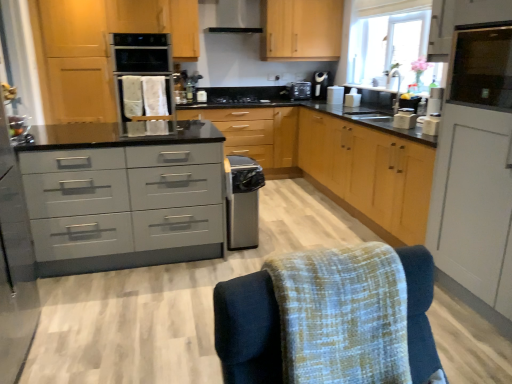
Question: Is the depth of textured fabric swivel chair at lower right greater than that of matte gray drawers at center?

Choices:
 (A) yes
 (B) no

Answer: (B)

Question: From a real-world perspective, is textured fabric swivel chair at lower right beneath matte gray drawers at center?

Choices:
 (A) yes
 (B) no

Answer: (B)

Question: Does textured fabric swivel chair at lower right have a greater width compared to matte gray drawers at center?

Choices:
 (A) no
 (B) yes

Answer: (A)

Question: Is textured fabric swivel chair at lower right not within matte gray drawers at center?

Choices:
 (A) yes
 (B) no

Answer: (A)

Question: Can you confirm if textured fabric swivel chair at lower right is bigger than matte gray drawers at center?

Choices:
 (A) no
 (B) yes

Answer: (A)

Question: Is point (227, 195) positioned closer to the camera than point (399, 253)?

Choices:
 (A) closer
 (B) farther

Answer: (B)

Question: In the image, is satin silver dishwasher at center on the left side or the right side of textured fabric swivel chair at lower right?

Choices:
 (A) right
 (B) left

Answer: (B)

Question: From a real-world perspective, is satin silver dishwasher at center physically located above or below textured fabric swivel chair at lower right?

Choices:
 (A) above
 (B) below

Answer: (B)

Question: From the image's perspective, is satin silver dishwasher at center above or below textured fabric swivel chair at lower right?

Choices:
 (A) above
 (B) below

Answer: (A)

Question: From the image's perspective, is transparent glass window screen at upper right above or below matte gray drawers at center?

Choices:
 (A) above
 (B) below

Answer: (A)

Question: From a real-world perspective, relative to matte gray drawers at center, is transparent glass window screen at upper right vertically above or below?

Choices:
 (A) below
 (B) above

Answer: (B)

Question: Considering their positions, is transparent glass window screen at upper right located in front of or behind matte gray drawers at center?

Choices:
 (A) front
 (B) behind

Answer: (A)

Question: Considering the positions of transparent glass window screen at upper right and matte gray drawers at center in the image, is transparent glass window screen at upper right taller or shorter than matte gray drawers at center?

Choices:
 (A) short
 (B) tall

Answer: (A)

Question: Is satin black coffee machine at upper right wider or thinner than transparent glass window screen at upper right?

Choices:
 (A) thin
 (B) wide

Answer: (B)

Question: In terms of height, does satin black coffee machine at upper right look taller or shorter compared to transparent glass window screen at upper right?

Choices:
 (A) short
 (B) tall

Answer: (A)